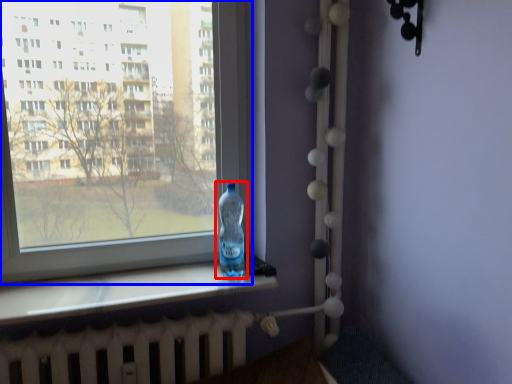
Question: Which of the following is the closest to the observer, bottle (highlighted by a red box) or window (highlighted by a blue box)?

Choices:
 (A) bottle
 (B) window

Answer: (B)